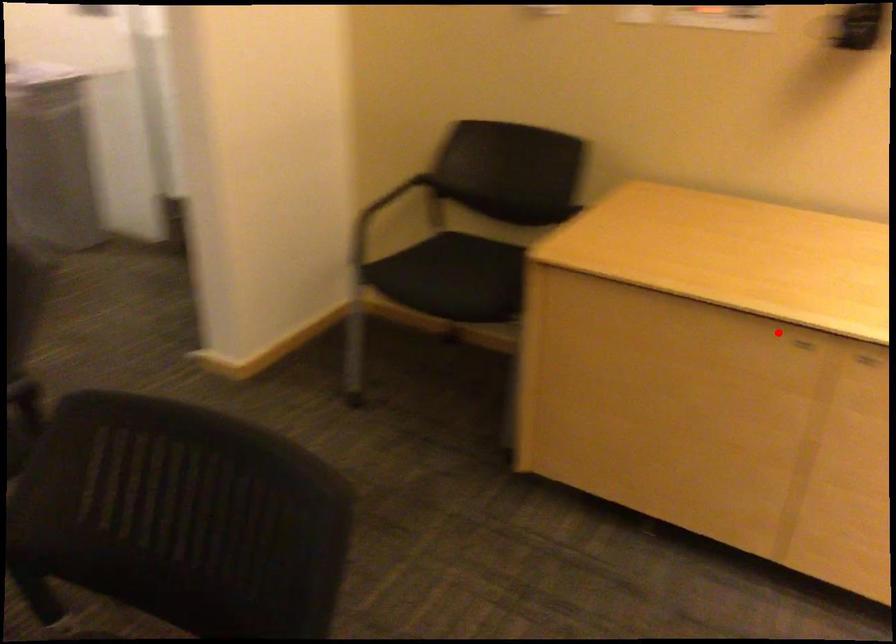
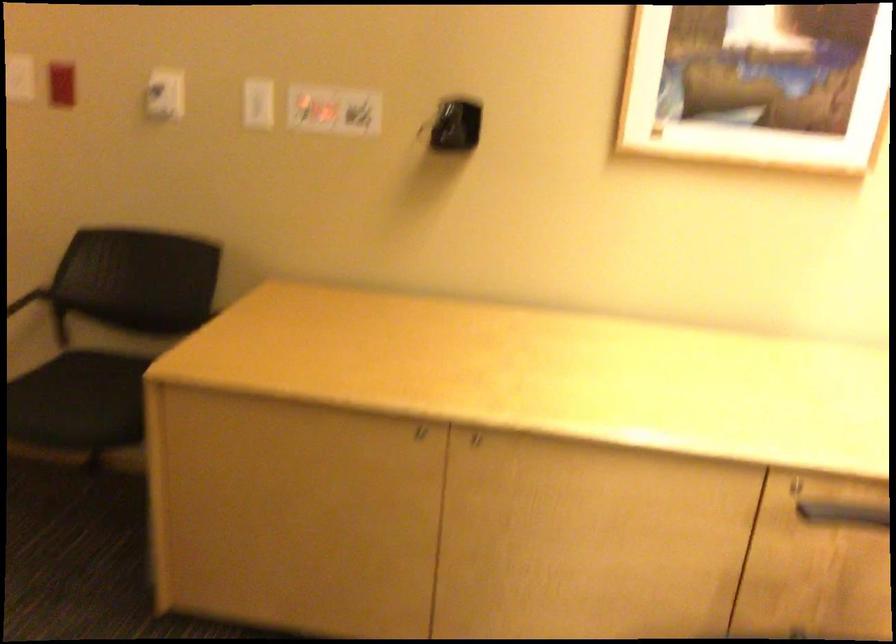
Where in the second image is the point corresponding to the highlighted location from the first image?

(410, 433)